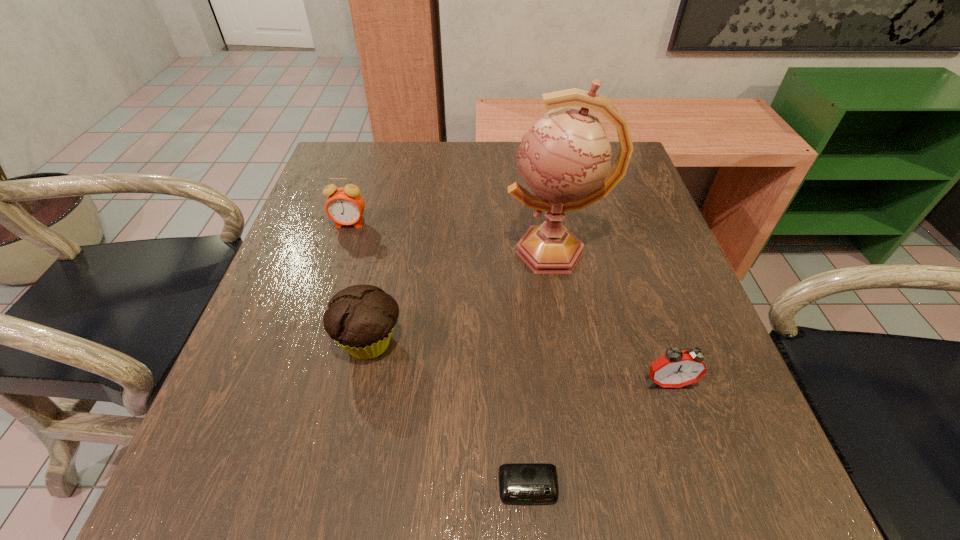
You are a GUI agent. You are given a task and a screenshot of the screen. Output one action in this format:
    pyautogui.click(x=<x>, y=<y>)
    Task: Click on the free space located 0.220m on the front-facing side of the tallest object
    The width and height of the screenshot is (960, 540).
    Given the screenshot: What is the action you would take?
    pyautogui.click(x=400, y=252)

Locate an element on the screen. free space located on the front-facing side of the tallest object is located at coordinates (382, 252).

Identify the location of vacant space located on the face of the farthest alarm clock. The width and height of the screenshot is (960, 540). (298, 384).

At what (x,y) coordinates should I click in order to perform the action: click on free space located 0.130m on the back of the muffin. Please return your answer as a coordinate pair (x, y). This screenshot has width=960, height=540. Looking at the image, I should click on (386, 267).

Image resolution: width=960 pixels, height=540 pixels. Identify the location of free space located on the clock face of the rightmost alarm clock. (684, 428).

Where is `object located in the near edge section of the desktop`? object located in the near edge section of the desktop is located at coordinates (519, 483).

Where is `alarm clock that is at the left edge`? Image resolution: width=960 pixels, height=540 pixels. alarm clock that is at the left edge is located at coordinates (345, 206).

This screenshot has width=960, height=540. What are the coordinates of `muffin located in the left edge section of the desktop` in the screenshot? It's located at (360, 318).

Find the location of a particular element. globe that is at the right edge is located at coordinates 565,158.

Where is `alarm clock located at the right edge`? This screenshot has height=540, width=960. alarm clock located at the right edge is located at coordinates (675, 369).